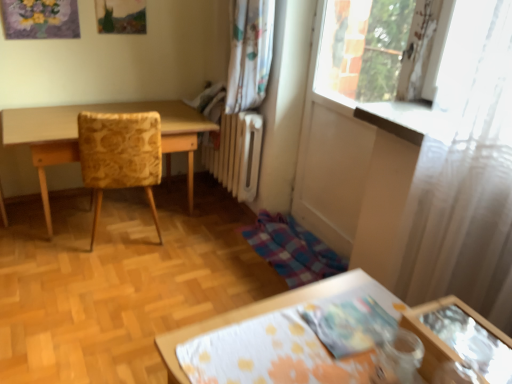
Question: Does light wood table at left touch yellow floral fabric chair at left?

Choices:
 (A) no
 (B) yes

Answer: (A)

Question: Considering the relative sizes of light wood table at left and yellow floral fabric chair at left in the image provided, is light wood table at left wider than yellow floral fabric chair at left?

Choices:
 (A) yes
 (B) no

Answer: (A)

Question: Does light wood table at left have a lesser width compared to yellow floral fabric chair at left?

Choices:
 (A) no
 (B) yes

Answer: (A)

Question: Is light wood table at left further to camera compared to yellow floral fabric chair at left?

Choices:
 (A) yes
 (B) no

Answer: (A)

Question: Is light wood table at left facing towards yellow floral fabric chair at left?

Choices:
 (A) yes
 (B) no

Answer: (A)

Question: From a real-world perspective, does light wood table at left stand above yellow floral fabric chair at left?

Choices:
 (A) yes
 (B) no

Answer: (B)

Question: Is the depth of yellow floral fabric chair at left greater than that of light wood table at left?

Choices:
 (A) no
 (B) yes

Answer: (A)

Question: Is yellow floral fabric chair at left at the left side of light wood table at left?

Choices:
 (A) yes
 (B) no

Answer: (B)

Question: From the image's perspective, is yellow floral fabric chair at left over light wood table at left?

Choices:
 (A) no
 (B) yes

Answer: (A)

Question: Can you see yellow floral fabric chair at left touching light wood table at left?

Choices:
 (A) yes
 (B) no

Answer: (B)

Question: Does yellow floral fabric chair at left appear on the right side of light wood table at left?

Choices:
 (A) no
 (B) yes

Answer: (B)

Question: From a real-world perspective, is yellow floral fabric chair at left physically above light wood table at left?

Choices:
 (A) no
 (B) yes

Answer: (B)

Question: From the image's perspective, does light wood table at left appear lower than white sheer curtain at right?

Choices:
 (A) no
 (B) yes

Answer: (A)